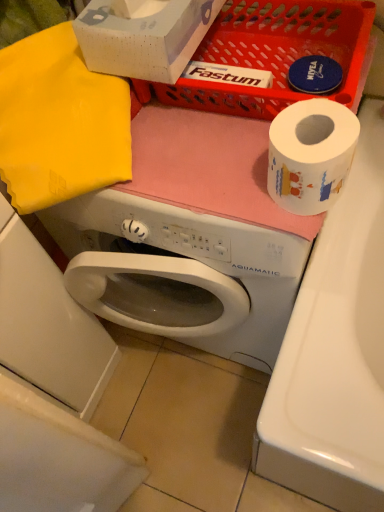
Find the location of `white matte washing machine at center`. white matte washing machine at center is located at coordinates (188, 240).

Describe the element at coordinates (48, 325) in the screenshot. I see `white glossy washing machine at lower left` at that location.

Where is `matte plastic basket at upper center`? The height and width of the screenshot is (512, 384). matte plastic basket at upper center is located at coordinates (273, 53).

From the image's perspective, which one is positioned lower, matte plastic basket at upper center or yellow fabric at upper left?

From the image's view, yellow fabric at upper left is below.

How many degrees apart are the facing directions of matte plastic basket at upper center and yellow fabric at upper left?

matte plastic basket at upper center and yellow fabric at upper left are facing 24.4 degrees away from each other.

Based on the photo, are matte plastic basket at upper center and yellow fabric at upper left far apart?

No, matte plastic basket at upper center is not far from yellow fabric at upper left.

The width and height of the screenshot is (384, 512). What are the coordinates of `basket lying above the yellow fabric at upper left (from the image's perspective)` in the screenshot? It's located at (273, 53).

From the image's perspective, which object appears higher, yellow fabric at upper left or white matte toilet paper at upper right?

yellow fabric at upper left is shown above in the image.

Is yellow fabric at upper left positioned behind white matte toilet paper at upper right?

Yes, it is.

Is yellow fabric at upper left far from white matte toilet paper at upper right?

yellow fabric at upper left is near white matte toilet paper at upper right, not far away.

From a real-world perspective, between white matte washing machine at center and yellow fabric at upper left, who is vertically higher?

In real-world perspective, yellow fabric at upper left is above.

Does white matte washing machine at center contain yellow fabric at upper left?

Definitely not — yellow fabric at upper left is not inside white matte washing machine at center.

Looking at the image, does white matte washing machine at center seem bigger or smaller compared to yellow fabric at upper left?

Clearly, white matte washing machine at center is larger in size than yellow fabric at upper left.

Is yellow fabric at upper left positioned far away from matte plastic basket at upper center?

yellow fabric at upper left is near matte plastic basket at upper center, not far away.

Considering the relative sizes of yellow fabric at upper left and matte plastic basket at upper center in the image provided, is yellow fabric at upper left taller than matte plastic basket at upper center?

Correct, yellow fabric at upper left is much taller as matte plastic basket at upper center.

Considering the relative sizes of yellow fabric at upper left and matte plastic basket at upper center in the image provided, is yellow fabric at upper left wider than matte plastic basket at upper center?

No, yellow fabric at upper left is not wider than matte plastic basket at upper center.

Is point (47, 49) positioned behind point (217, 62)?

No, (47, 49) is in front of (217, 62).

Considering the sizes of white matte washing machine at center and white glossy washing machine at lower left in the image, is white matte washing machine at center bigger or smaller than white glossy washing machine at lower left?

Clearly, white matte washing machine at center is larger in size than white glossy washing machine at lower left.

From the image's perspective, is white matte washing machine at center positioned above or below white glossy washing machine at lower left?

Based on their image positions, white matte washing machine at center is located above white glossy washing machine at lower left.

Which of these two, white matte washing machine at center or white glossy washing machine at lower left, stands shorter?

white matte washing machine at center.

Can white matte toilet paper at upper right be found inside white matte washing machine at center?

No, white matte toilet paper at upper right is not surrounded by white matte washing machine at center.

Which object is positioned more to the left, white matte washing machine at center or white matte toilet paper at upper right?

From the viewer's perspective, white matte washing machine at center appears more on the left side.

From a real-world perspective, is white matte washing machine at center above or below white matte toilet paper at upper right?

white matte washing machine at center is below white matte toilet paper at upper right.

In order to click on toilet paper located in front of the white matte washing machine at center in this screenshot , I will do `click(310, 154)`.

Can you confirm if matte plastic basket at upper center is positioned to the right of white matte toilet paper at upper right?

In fact, matte plastic basket at upper center is to the left of white matte toilet paper at upper right.

From the image's perspective, is matte plastic basket at upper center on white matte toilet paper at upper right?

Yes, from the image's perspective, matte plastic basket at upper center is on top of white matte toilet paper at upper right.

Is white matte toilet paper at upper right completely or partially inside matte plastic basket at upper center?

No, white matte toilet paper at upper right is located outside of matte plastic basket at upper center.

At what (x,y) coordinates should I click in order to perform the action: click on toilet paper lying below the matte plastic basket at upper center (from the image's perspective). Please return your answer as a coordinate pair (x, y). The image size is (384, 512). Looking at the image, I should click on (310, 154).

In the image, there is a matte plastic basket at upper center. Find the location of `clothe below it (from a real-world perspective)`. clothe below it (from a real-world perspective) is located at coordinates (59, 122).

Where is `toilet paper below the yellow fabric at upper left (from the image's perspective)`? The image size is (384, 512). toilet paper below the yellow fabric at upper left (from the image's perspective) is located at coordinates (310, 154).

From the image, which object appears to be farther from white glossy washing machine at lower left, white matte washing machine at center or white matte toilet paper at upper right?

white matte toilet paper at upper right lies further to white glossy washing machine at lower left than the other object.

Based on their spatial positions, is matte plastic basket at upper center or yellow fabric at upper left closer to white matte washing machine at center?

yellow fabric at upper left.

Considering their positions, is matte plastic basket at upper center positioned further to yellow fabric at upper left than white glossy washing machine at lower left?

Among the two, white glossy washing machine at lower left is located further to yellow fabric at upper left.

Based on their spatial positions, is white matte washing machine at center or white glossy washing machine at lower left further from yellow fabric at upper left?

white glossy washing machine at lower left lies further to yellow fabric at upper left than the other object.

Looking at the image, which one is located further to matte plastic basket at upper center, white matte toilet paper at upper right or yellow fabric at upper left?

yellow fabric at upper left is further to matte plastic basket at upper center.

From the image, which object appears to be nearer to white matte toilet paper at upper right, yellow fabric at upper left or white glossy washing machine at lower left?

Based on the image, yellow fabric at upper left appears to be nearer to white matte toilet paper at upper right.

Estimate the real-world distances between objects in this image. Which object is further from matte plastic basket at upper center, white matte toilet paper at upper right or white matte washing machine at center?

white matte washing machine at center is positioned further to the anchor matte plastic basket at upper center.

Looking at the image, which one is located further to white matte washing machine at center, white glossy washing machine at lower left or white matte toilet paper at upper right?

white matte toilet paper at upper right is further to white matte washing machine at center.

In order to click on clothe between matte plastic basket at upper center and white matte washing machine at center in the vertical direction in this screenshot , I will do `click(59, 122)`.

Locate an element on the screen. washing machine between yellow fabric at upper left and white matte toilet paper at upper right in the horizontal direction is located at coordinates (188, 240).

This screenshot has height=512, width=384. Identify the location of clothe situated between white glossy washing machine at lower left and white matte washing machine at center from left to right. (59, 122).

Locate an element on the screen. The height and width of the screenshot is (512, 384). clothe located between white glossy washing machine at lower left and white matte toilet paper at upper right in the left-right direction is located at coordinates (59, 122).